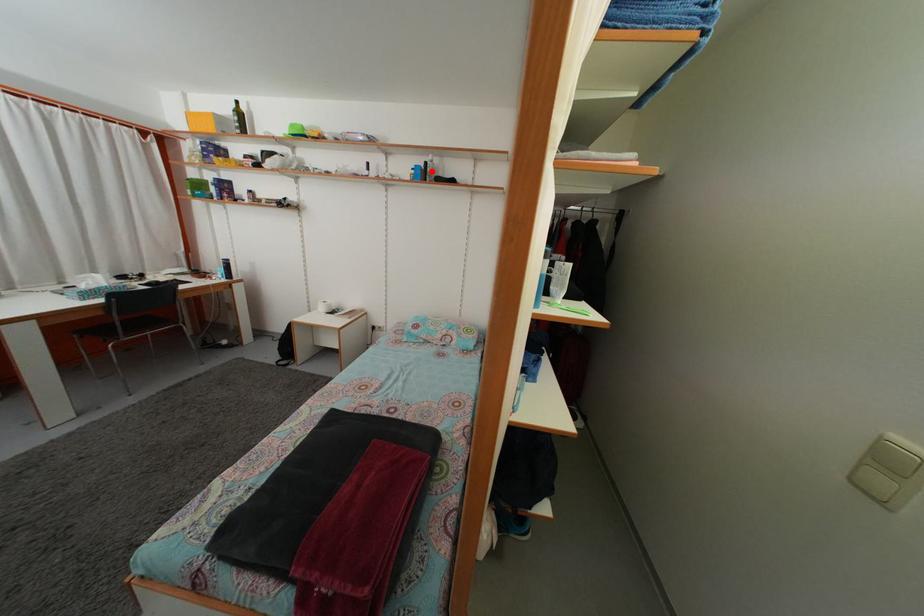
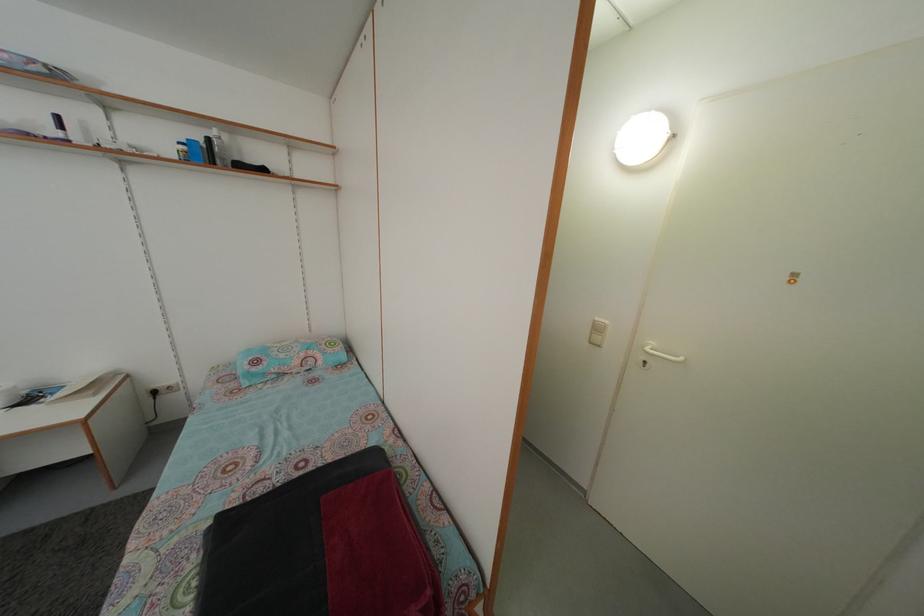
Locate, in the second image, the point that corresponds to the highlighted location in the first image.

(214, 148)